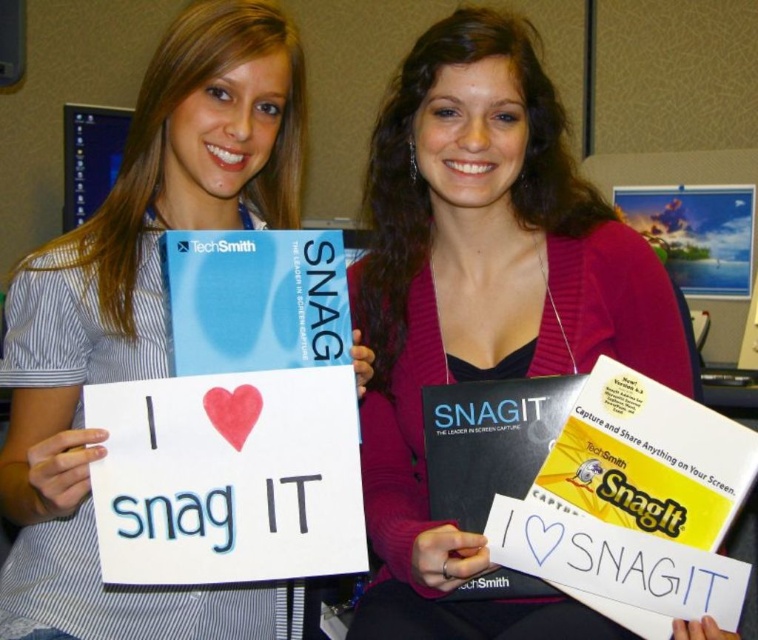
Question: Which point is farther from the camera taking this photo?

Choices:
 (A) pos(544,205)
 (B) pos(111,616)

Answer: (A)

Question: Can you confirm if white paper sign at center is positioned to the right of black matte book at center?

Choices:
 (A) yes
 (B) no

Answer: (B)

Question: Which object is farther from the camera taking this photo?

Choices:
 (A) white paper sign at center
 (B) black matte book at center
 (C) matte black book at center

Answer: (B)

Question: Is matte black book at center to the left of black matte book at center from the viewer's perspective?

Choices:
 (A) no
 (B) yes

Answer: (B)

Question: Which point is closer to the camera taking this photo?

Choices:
 (A) (694, 561)
 (B) (547, 237)
 (C) (55, 513)

Answer: (A)

Question: Does white paper sign at center lie behind black matte book at center?

Choices:
 (A) no
 (B) yes

Answer: (A)